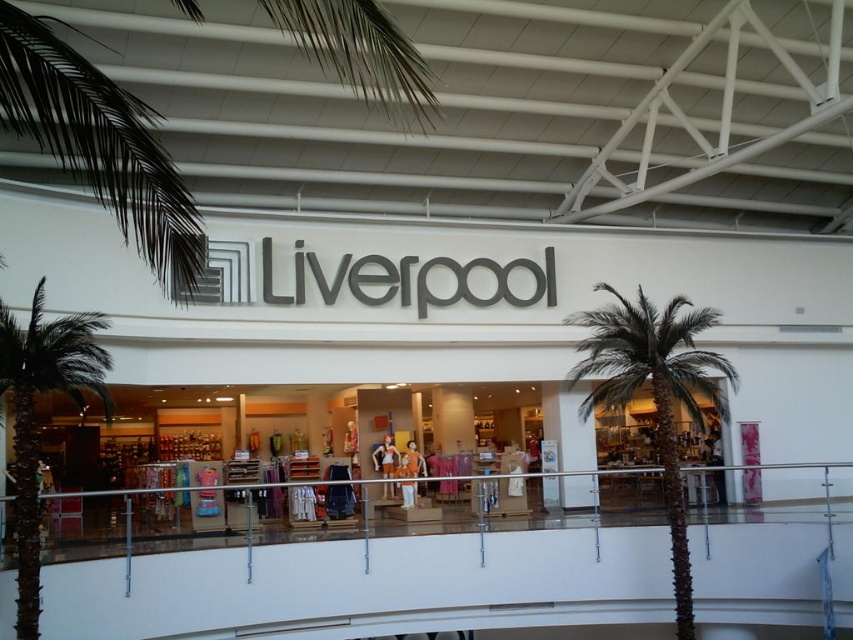
You are standing at the entrance of the Liverpool store and want to place a decorative item exactly at the center of the store. Considering the brown textured palm tree at center is at coordinates point 0.616, 0.768, where should you place the item?

The brown textured palm tree at center is located at point (654, 394), so the center of the store is likely near this coordinate. Place the decorative item there.

You are standing at the entrance of the Liverpool store in the mall. You see two points marked in the image. The first point is at coordinates point (x=691, y=317) and the second is at point (x=26, y=563). If you were to walk from the entrance towards the first point, would you pass by the second point along the way?

The point (x=691, y=317) is behind the point (x=26, y=563). Therefore, walking from the entrance towards the first point, you would pass by the second point along the way.

You are a customer entering the Liverpool store and want to pass between the brown textured palm tree at center and the green leafy palm tree at left. Can you walk through the space between them comfortably?

The brown textured palm tree at center has a lesser width compared to green leafy palm tree at left, so the space between them might be narrower. It is advisable to check the actual distance before attempting to pass through.